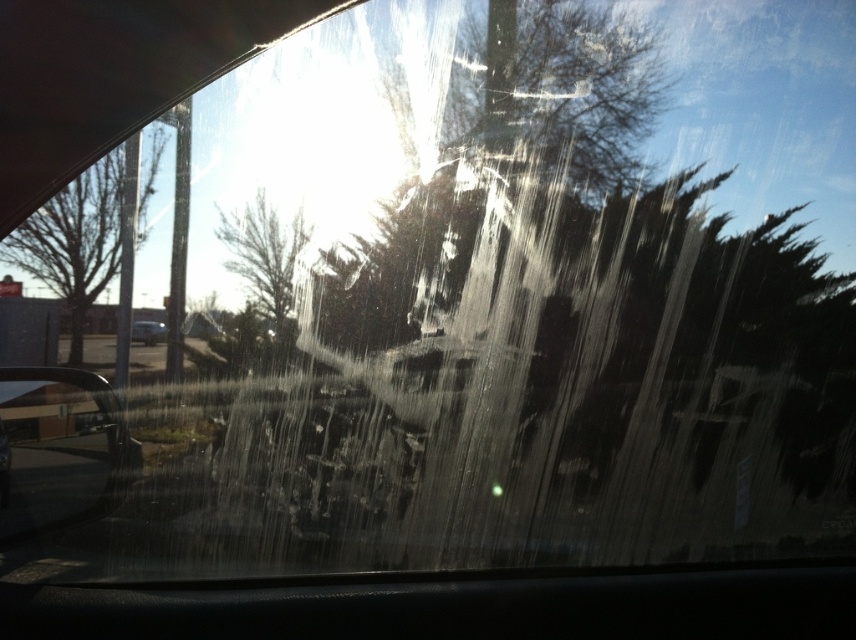
You are a passenger in the car and want to know if the bare branches at left will block the view of the metallic silver car at lower left. Based on their heights, can you determine if the branches are tall enough to block the view?

The bare branches at left is much taller than the metallic silver car at lower left, so the branches are tall enough to block the view of the metallic silver car at lower left.

You are sitting inside a car and looking out the window. There is a point marked at coordinate (74, 241). What does this point correspond to in the scene?

The point at (74, 241) corresponds to the bare branches at left.